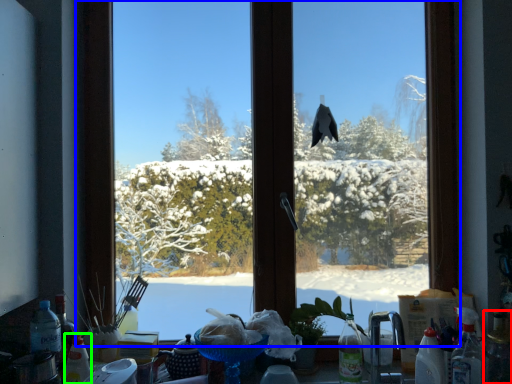
Question: Considering the real-world distances, which object is closest to bottle (highlighted by a red box)? window (highlighted by a blue box) or bottle (highlighted by a green box).

Choices:
 (A) window
 (B) bottle

Answer: (A)